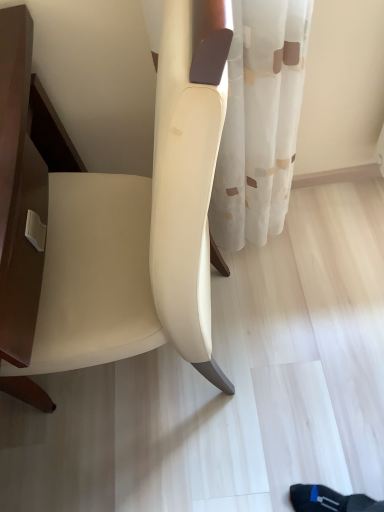
Locate an element on the screen. The height and width of the screenshot is (512, 384). vacant area in front of matte white chair at left is located at coordinates (223, 447).